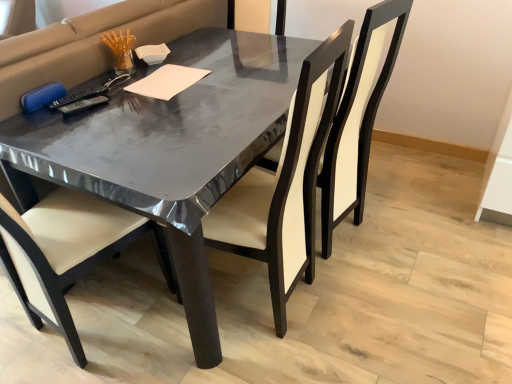
Image resolution: width=512 pixels, height=384 pixels. I want to click on free spot behind white paper at center, so click(196, 61).